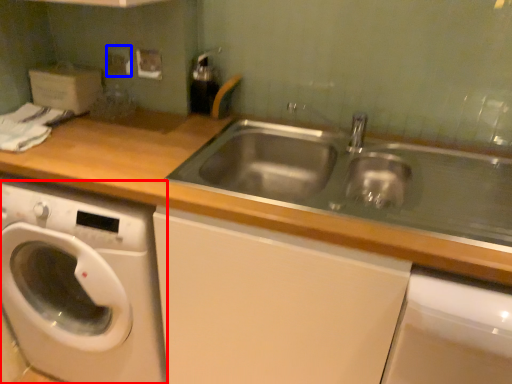
Question: Which object appears closest to the camera in this image, washing machine (highlighted by a red box) or electric outlet (highlighted by a blue box)?

Choices:
 (A) washing machine
 (B) electric outlet

Answer: (A)